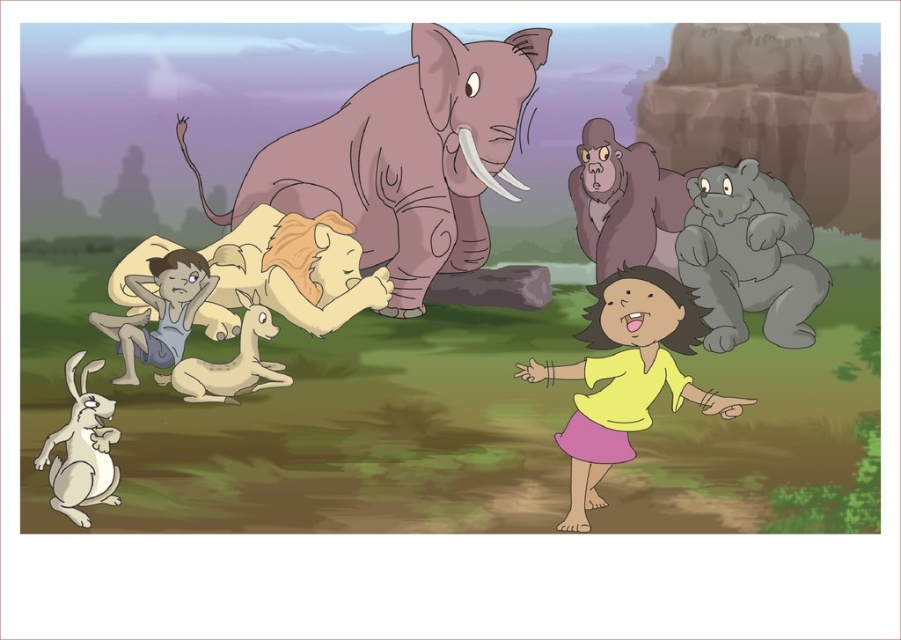
You are an animal caretaker who needs to place a 15 inch wide feeding trough between the purple matte elephant at center and the gray matte elephant at upper center. Can the trough fit between them?

The distance between the purple matte elephant at center and the gray matte elephant at upper center is 14.92 inches, which is slightly less than the 15 inch width of the feeding trough. Therefore, the trough cannot fit between them.

You are a child trying to sit between the blue denim shorts at lower left and the white matte rabbit at lower left. Can you fit comfortably?

The blue denim shorts at lower left might be wider than white matte rabbit at lower left, so there might be enough space for you to sit comfortably between them.